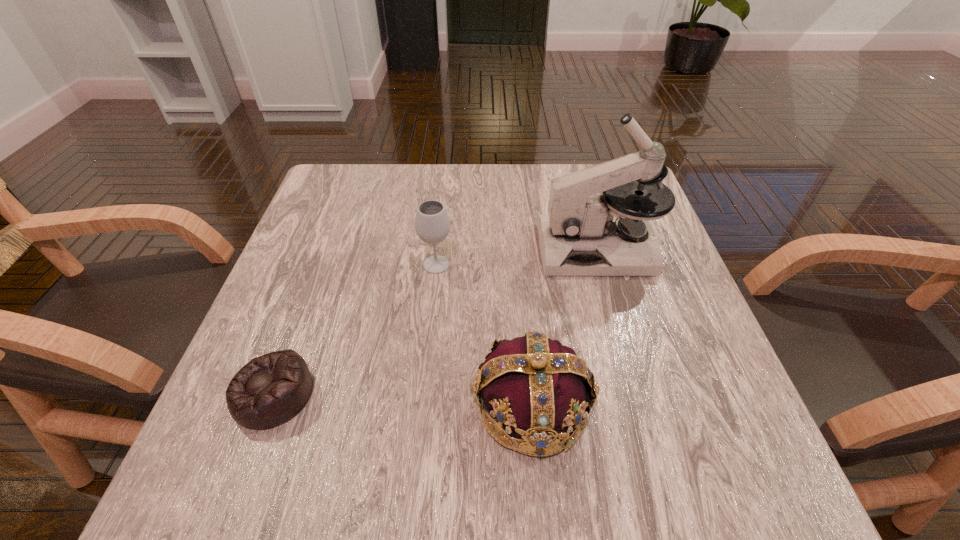
You are a GUI agent. You are given a task and a screenshot of the screen. Output one action in this format:
    pyautogui.click(x=<x>, y=<y>)
    Task: Click on the free region located on the back of the leftmost object
    Image resolution: width=960 pixels, height=540 pixels.
    Given the screenshot: What is the action you would take?
    pyautogui.click(x=305, y=308)

Identify the location of object that is positioned at the near edge. Image resolution: width=960 pixels, height=540 pixels. (536, 386).

The height and width of the screenshot is (540, 960). I want to click on object situated at the left edge, so click(270, 390).

The image size is (960, 540). I want to click on object present at the right edge, so click(x=581, y=235).

Find the location of a particular element. Image resolution: width=960 pixels, height=540 pixels. free space at the far edge of the desktop is located at coordinates point(414,201).

Where is `vacant point at the near edge`? vacant point at the near edge is located at coordinates (646, 462).

You are a GUI agent. You are given a task and a screenshot of the screen. Output one action in this format:
    pyautogui.click(x=<x>, y=<y>)
    Task: Click on the blank space at the left edge
    The width and height of the screenshot is (960, 540).
    Given the screenshot: What is the action you would take?
    pyautogui.click(x=310, y=269)

Where is `vacant area at the right edge`? vacant area at the right edge is located at coordinates (686, 288).

The width and height of the screenshot is (960, 540). In order to click on blank space at the far left corner in this screenshot , I will do `click(337, 207)`.

The height and width of the screenshot is (540, 960). In the image, there is a desktop. In order to click on free region at the near left corner in this screenshot , I will do `click(225, 447)`.